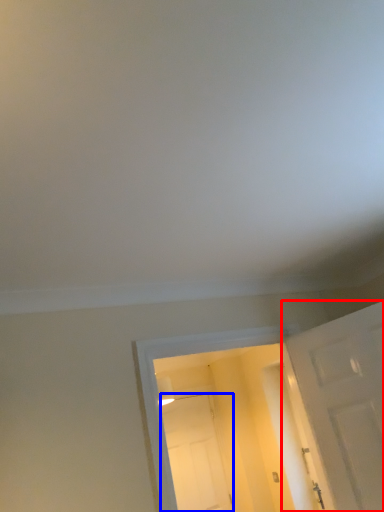
Question: Among these objects, which one is nearest to the camera, door (highlighted by a red box) or door (highlighted by a blue box)?

Choices:
 (A) door
 (B) door

Answer: (A)